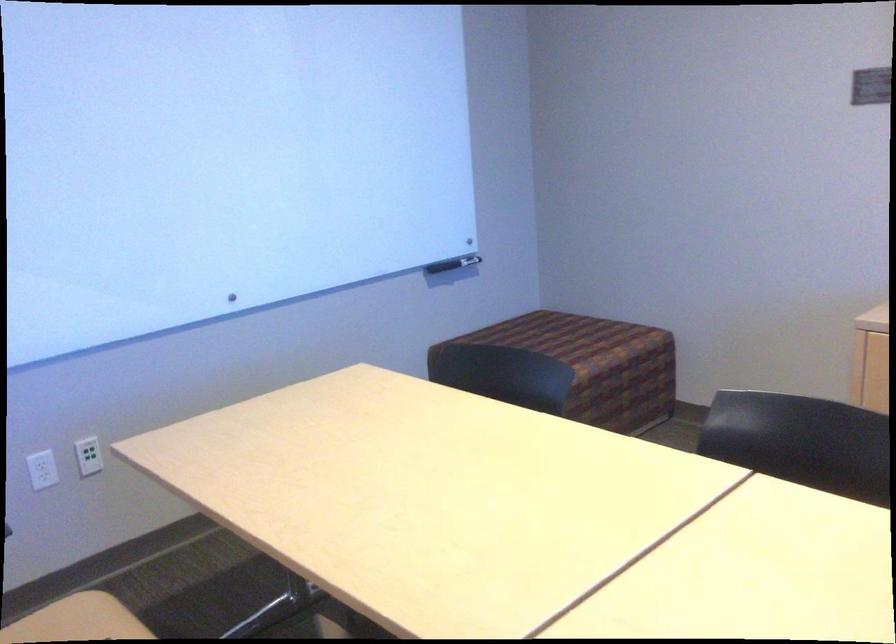
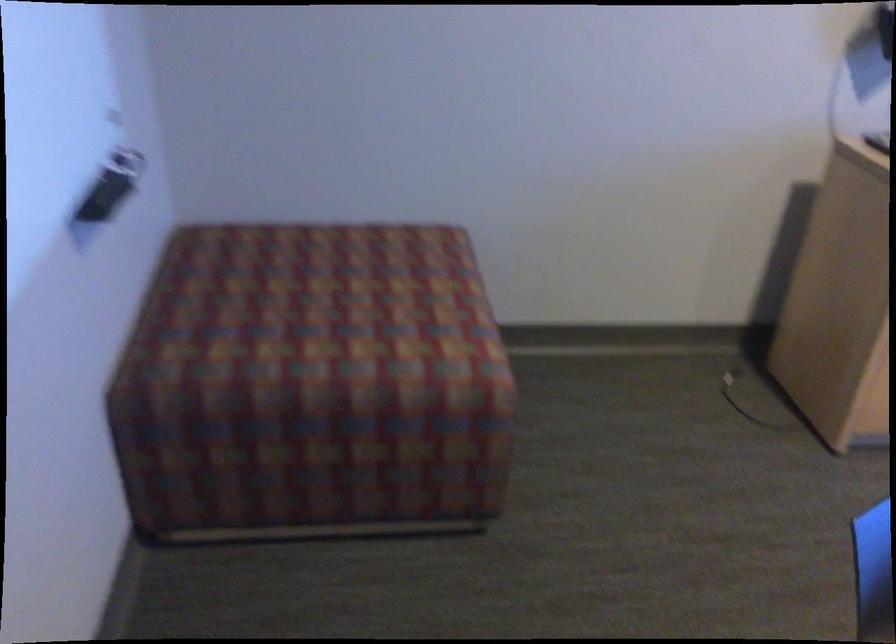
Find the pixel in the second image that matches pixel 543 336 in the first image.

(332, 301)